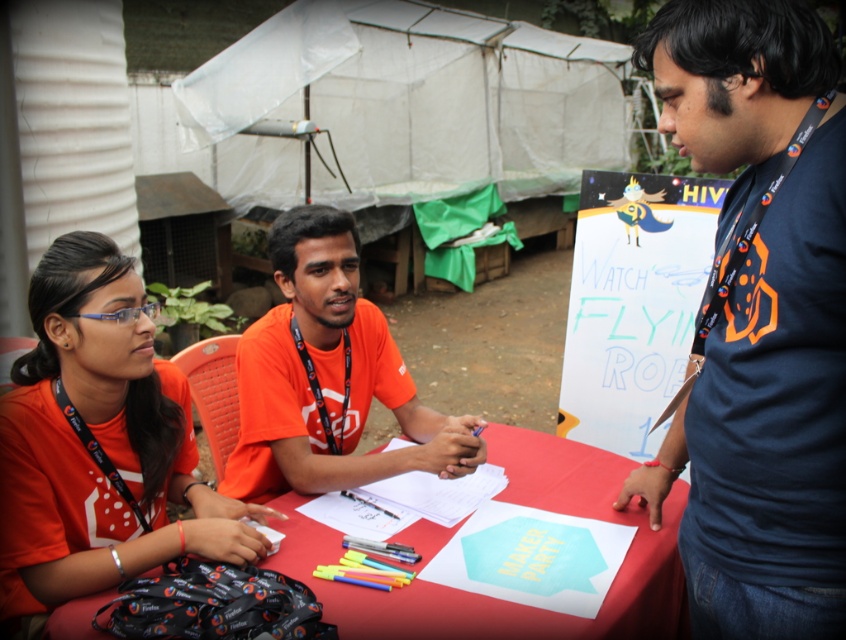
Consider the image. Who is lower down, matte orange shirt at left or red fabric tablecloth at center?

red fabric tablecloth at center is below.

Locate an element on the screen. matte orange shirt at left is located at coordinates (99, 442).

I want to click on matte orange shirt at left, so click(99, 442).

Is dark blue t-shirt at right above red fabric tablecloth at center?

Yes, dark blue t-shirt at right is above red fabric tablecloth at center.

Can you confirm if dark blue t-shirt at right is positioned to the right of red fabric tablecloth at center?

Indeed, dark blue t-shirt at right is positioned on the right side of red fabric tablecloth at center.

Which is behind, point (819, 88) or point (268, 560)?

Point (268, 560)

Locate an element on the screen. dark blue t-shirt at right is located at coordinates (768, 422).

Does orange fabric shirt at center appear on the right side of red fabric tablecloth at center?

In fact, orange fabric shirt at center is to the left of red fabric tablecloth at center.

How much distance is there between orange fabric shirt at center and red fabric tablecloth at center?

They are 11.97 inches apart.

Is point (262, 392) positioned before point (531, 456)?

Yes, it is in front of point (531, 456).

Locate an element on the screen. This screenshot has width=846, height=640. orange fabric shirt at center is located at coordinates click(327, 376).